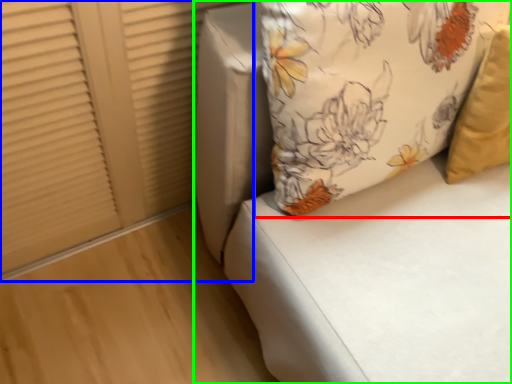
Question: Based on their relative distances, which object is farther from pillow (highlighted by a red box)? Choose from shutter (highlighted by a blue box) and furniture (highlighted by a green box).

Choices:
 (A) shutter
 (B) furniture

Answer: (A)